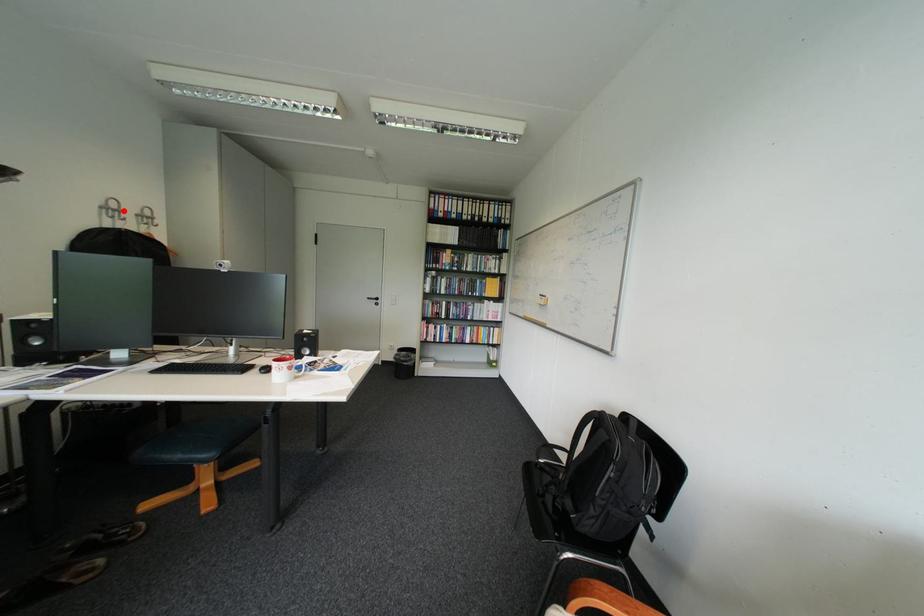
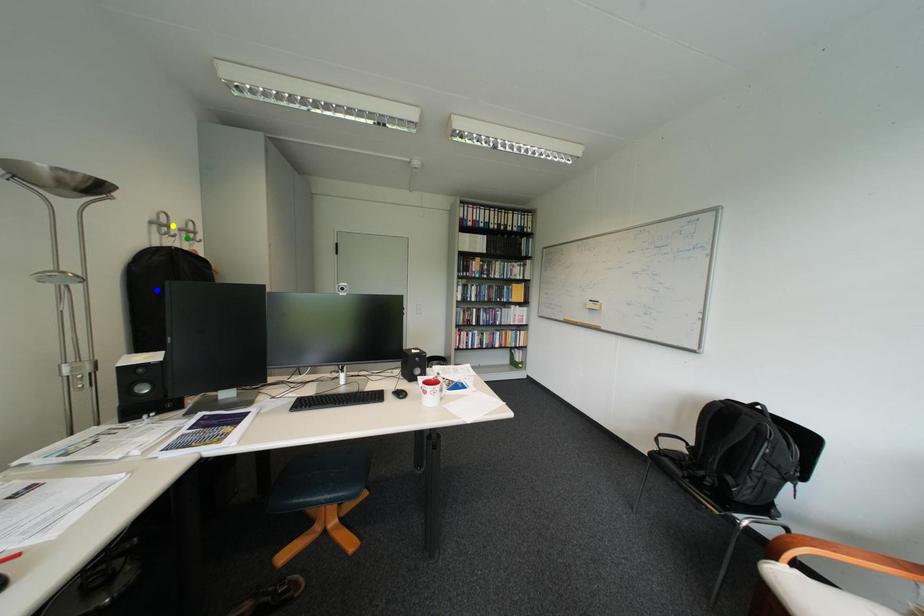
Question: I am providing you with two images of the same scene from different viewpoints. A red point is marked on the first image. You are given multiple points on the second image. Which point in image 2 represents the same 3d spot as the red point in image 1?

Choices:
 (A) yellow point
 (B) blue point
 (C) green point

Answer: (A)